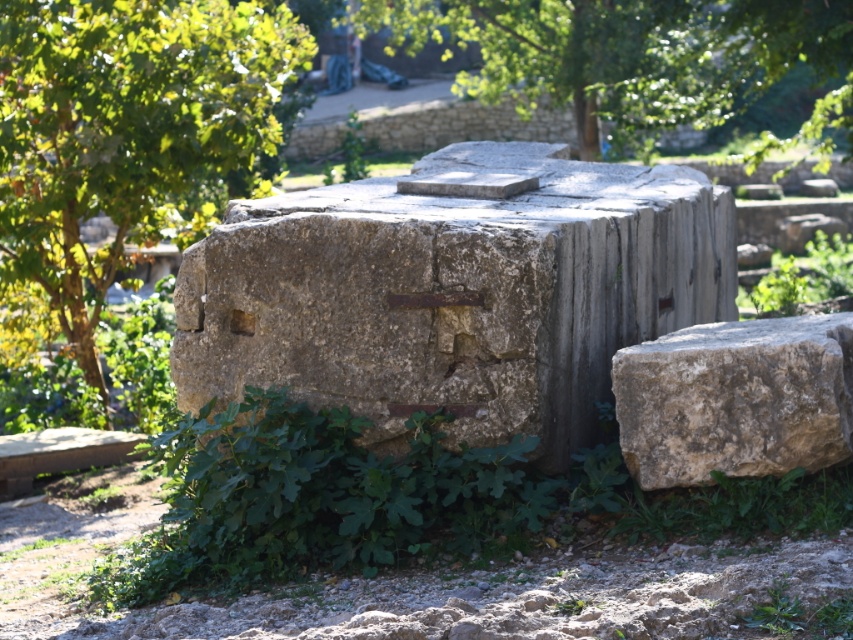
You are an archaeologist examining the ancient stone structures. You need to determine which object is bigger between the rusty stone millstone at center and the natural stone boulder at lower right. Based on the scene, which one is larger?

The rusty stone millstone at center is larger in size than the natural stone boulder at lower right, so the rusty stone millstone at center is bigger.

You are standing in front of the ancient stone blocks and want to take a photo that includes both the green leafy tree at lower left and the green leafy tree at upper center. Which tree should you position closer to the camera to ensure both are in focus?

You should position the green leafy tree at lower left closer to the camera because it is much taller than the green leafy tree at upper center, so adjusting their distances can help maintain focus on both.